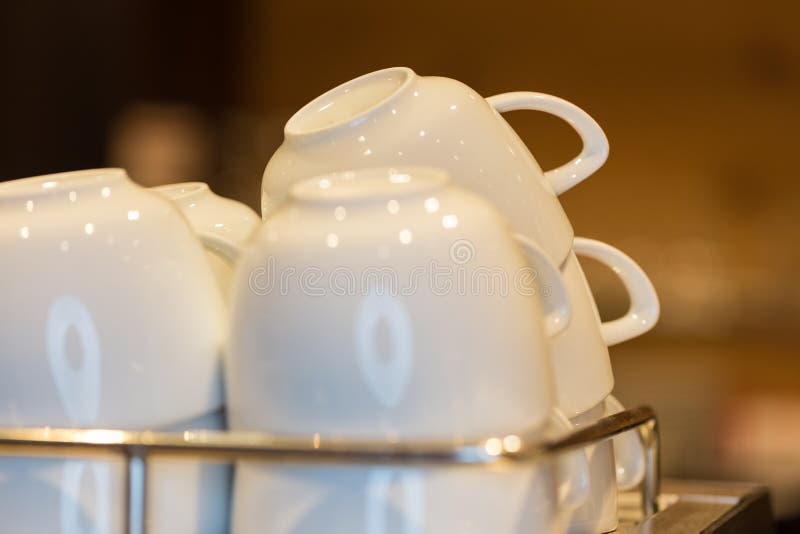
This screenshot has height=534, width=800. I want to click on drink cups, so click(x=165, y=299), click(x=206, y=218), click(x=330, y=172), click(x=364, y=312), click(x=570, y=349), click(x=592, y=444), click(x=402, y=502), click(x=173, y=501).